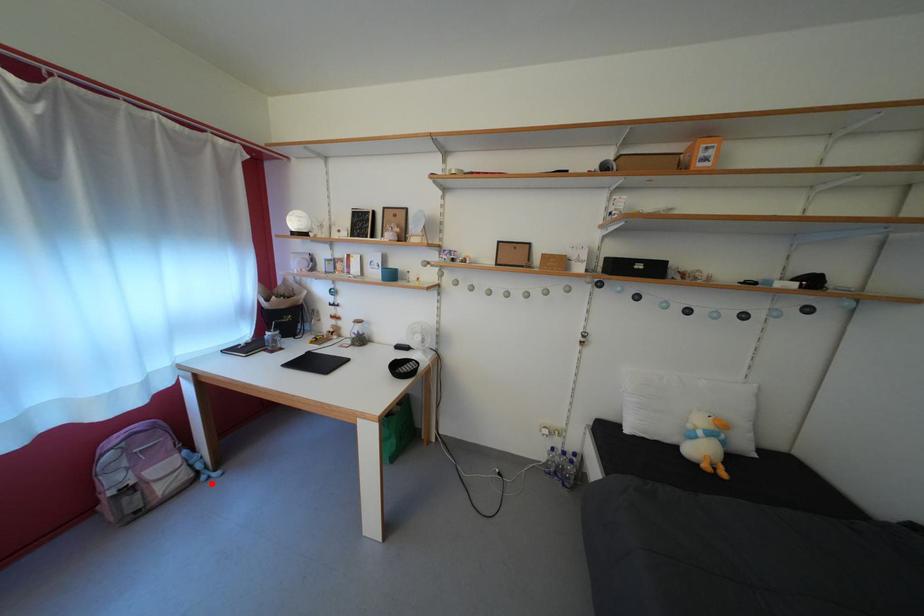
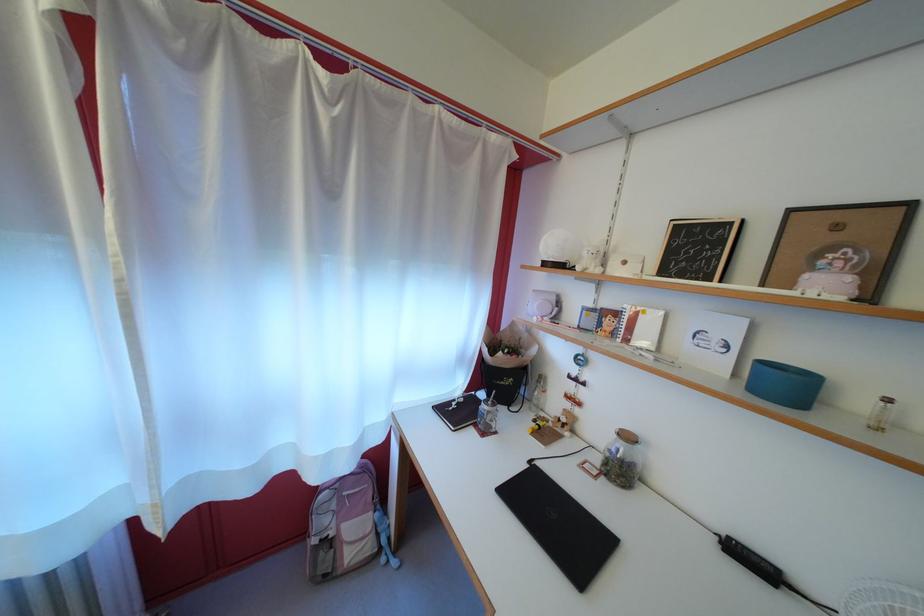
Question: I am providing you with two images of the same scene from different viewpoints. Given a red point in image1, look at the same physical point in image2. Is it:

Choices:
 (A) Closer to the viewpoint
 (B) Farther from the viewpoint

Answer: (B)